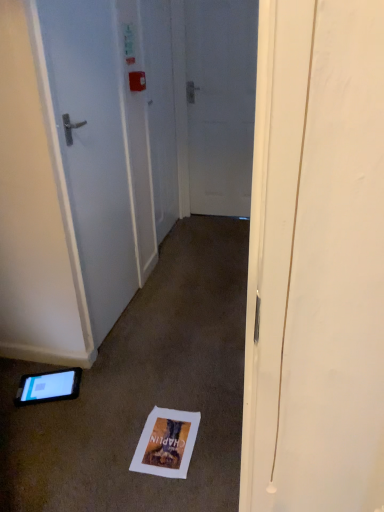
Question: Does white glossy door at left, marked as the 1th door in a front-to-back arrangement, have a lesser width compared to white paper postcard at lower center?

Choices:
 (A) yes
 (B) no

Answer: (A)

Question: Can white paper postcard at lower center be found inside white glossy door at left, marked as the 2th door in a back-to-front arrangement?

Choices:
 (A) yes
 (B) no

Answer: (B)

Question: Is white glossy door at left, marked as the 2th door in a back-to-front arrangement, positioned before white paper postcard at lower center?

Choices:
 (A) no
 (B) yes

Answer: (B)

Question: From a real-world perspective, is white glossy door at left, the 1th door in the left-to-right sequence, located beneath white paper postcard at lower center?

Choices:
 (A) yes
 (B) no

Answer: (B)

Question: Does white glossy door at left, marked as the 2th door in a back-to-front arrangement, have a smaller size compared to white paper postcard at lower center?

Choices:
 (A) yes
 (B) no

Answer: (B)

Question: Considering the relative sizes of white glossy door at left, marked as the 1th door in a front-to-back arrangement, and white paper postcard at lower center in the image provided, is white glossy door at left, marked as the 1th door in a front-to-back arrangement, taller than white paper postcard at lower center?

Choices:
 (A) no
 (B) yes

Answer: (B)

Question: Is black glossy tablet at lower left to the right of white paper postcard at lower center from the viewer's perspective?

Choices:
 (A) yes
 (B) no

Answer: (B)

Question: From the image's perspective, is black glossy tablet at lower left beneath white paper postcard at lower center?

Choices:
 (A) no
 (B) yes

Answer: (A)

Question: Considering the relative sizes of black glossy tablet at lower left and white paper postcard at lower center in the image provided, is black glossy tablet at lower left bigger than white paper postcard at lower center?

Choices:
 (A) yes
 (B) no

Answer: (A)

Question: Can you confirm if black glossy tablet at lower left is shorter than white paper postcard at lower center?

Choices:
 (A) yes
 (B) no

Answer: (B)

Question: From a real-world perspective, is black glossy tablet at lower left physically above white paper postcard at lower center?

Choices:
 (A) yes
 (B) no

Answer: (A)

Question: Does black glossy tablet at lower left turn towards white paper postcard at lower center?

Choices:
 (A) no
 (B) yes

Answer: (A)

Question: Is white paper postcard at lower center thinner than white matte door at center, placed as the second door when sorted from left to right?

Choices:
 (A) no
 (B) yes

Answer: (A)